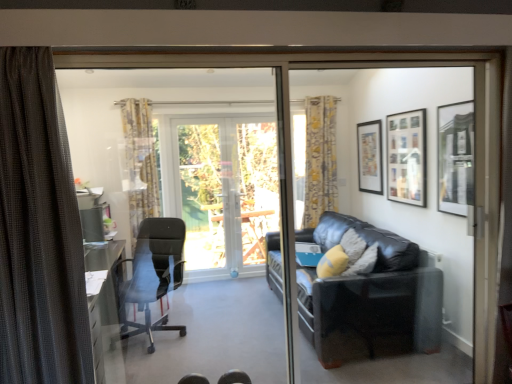
Question: Is matte black picture frame at upper right, which is the 2th picture frame from back to front, positioned in front of black leather couch at right, which is the first screen door from right to left?

Choices:
 (A) no
 (B) yes

Answer: (A)

Question: Is matte black picture frame at upper right, which is the 2th picture frame from back to front, outside black leather couch at right, which is the first screen door from right to left?

Choices:
 (A) yes
 (B) no

Answer: (A)

Question: From a real-world perspective, is matte black picture frame at upper right, which is the 2th picture frame from front to back, physically above black leather couch at right, placed as the second screen door when sorted from left to right?

Choices:
 (A) yes
 (B) no

Answer: (A)

Question: Is matte black picture frame at upper right, which is the 2th picture frame from front to back, shorter than black leather couch at right, placed as the second screen door when sorted from left to right?

Choices:
 (A) yes
 (B) no

Answer: (A)

Question: From the image's perspective, is matte black picture frame at upper right, which is the 2th picture frame from back to front, above black leather couch at right, placed as the second screen door when sorted from left to right?

Choices:
 (A) no
 (B) yes

Answer: (B)

Question: Relative to yellow fabric pillow at right, is matte black picture frame at upper right, acting as the 3th picture frame starting from the front, in front or behind?

Choices:
 (A) front
 (B) behind

Answer: (B)

Question: Is matte black picture frame at upper right, acting as the 3th picture frame starting from the front, bigger or smaller than yellow fabric pillow at right?

Choices:
 (A) big
 (B) small

Answer: (A)

Question: In terms of height, does matte black picture frame at upper right, acting as the 3th picture frame starting from the front, look taller or shorter compared to yellow fabric pillow at right?

Choices:
 (A) tall
 (B) short

Answer: (A)

Question: From a real-world perspective, is matte black picture frame at upper right, the 1th picture frame when ordered from back to front, above or below yellow fabric pillow at right?

Choices:
 (A) below
 (B) above

Answer: (B)

Question: Is black leather couch at right, which is the first screen door from right to left, taller or shorter than matte black picture frame at upper right, positioned as the 1th picture frame in front-to-back order?

Choices:
 (A) tall
 (B) short

Answer: (A)

Question: In terms of width, does black leather couch at right, which is the first screen door from right to left, look wider or thinner when compared to matte black picture frame at upper right, the third picture frame in the back-to-front sequence?

Choices:
 (A) thin
 (B) wide

Answer: (B)

Question: Based on their positions, is black leather couch at right, placed as the second screen door when sorted from left to right, located to the left or right of matte black picture frame at upper right, positioned as the 1th picture frame in front-to-back order?

Choices:
 (A) left
 (B) right

Answer: (A)

Question: Considering the positions of point (454, 253) and point (450, 185), is point (454, 253) closer or farther from the camera than point (450, 185)?

Choices:
 (A) closer
 (B) farther

Answer: (A)

Question: Based on their positions, is black leather couch at right located to the left or right of black leather couch at right, placed as the second screen door when sorted from left to right?

Choices:
 (A) left
 (B) right

Answer: (A)

Question: Is black leather couch at right wider or thinner than black leather couch at right, which is the first screen door from right to left?

Choices:
 (A) thin
 (B) wide

Answer: (B)